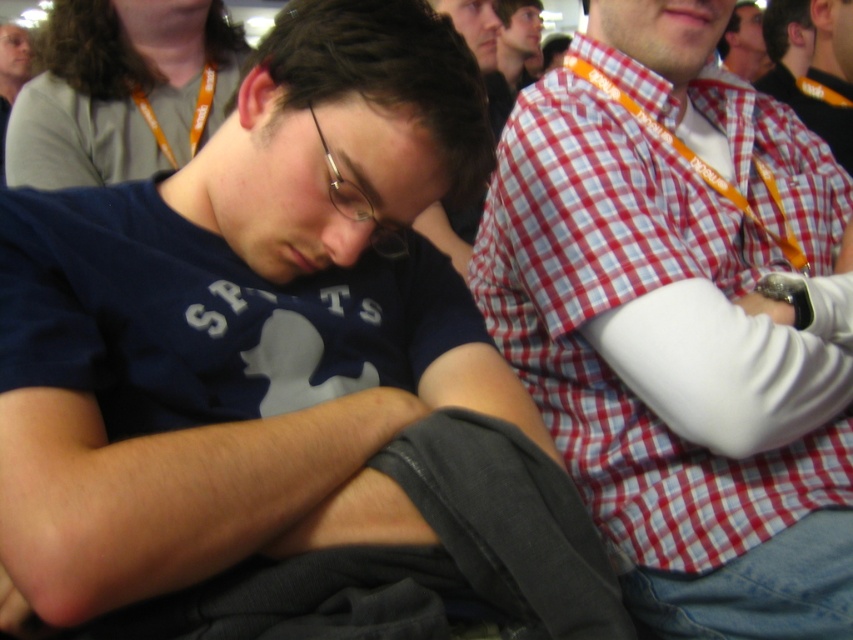
Question: Which object is positioned farthest from the checkered fabric shirt at upper right?

Choices:
 (A) matte black glasses at upper center
 (B) gray fabric shirt at upper left

Answer: (B)

Question: Is the position of gray fabric shirt at upper left more distant than that of smooth black hair at upper right?

Choices:
 (A) yes
 (B) no

Answer: (B)

Question: Is checkered fabric shirt at upper right behind smooth black hair at upper right?

Choices:
 (A) no
 (B) yes

Answer: (A)

Question: Which object appears farthest from the camera in this image?

Choices:
 (A) matte blue shirt at center
 (B) checkered fabric shirt at upper right
 (C) gray fabric shirt at upper left
 (D) matte black glasses at upper center

Answer: (D)

Question: Which point is closer to the camera taking this photo?

Choices:
 (A) (672, 374)
 (B) (750, 81)
 (C) (791, 74)

Answer: (A)

Question: Is red checkered shirt at center wider than checkered fabric shirt at upper right?

Choices:
 (A) no
 (B) yes

Answer: (B)